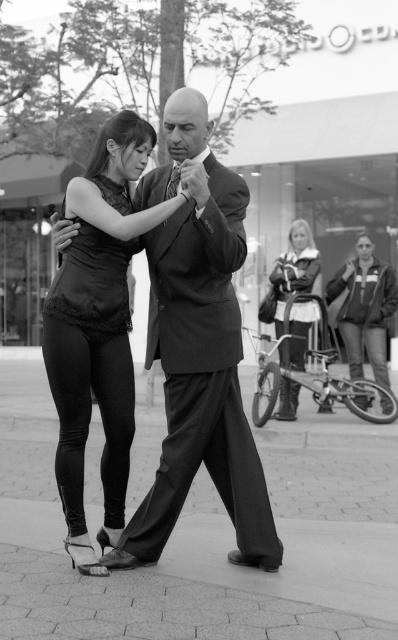
Is point (115, 193) positioned in front of point (282, 305)?

That is True.

Does silky black dress at center have a greater width compared to velvet-like black dress at center?

No.

Describe the element at coordinates (93, 282) in the screenshot. This screenshot has width=398, height=640. I see `silky black dress at center` at that location.

At what (x,y) coordinates should I click in order to perform the action: click on silky black dress at center. Please return your answer as a coordinate pair (x, y). Image resolution: width=398 pixels, height=640 pixels. Looking at the image, I should click on (93, 282).

Is the position of smooth concrete pavement at center more distant than that of velvet-like black dress at center?

No, smooth concrete pavement at center is in front of velvet-like black dress at center.

Who is positioned more to the right, smooth concrete pavement at center or velvet-like black dress at center?

velvet-like black dress at center

Which is behind, point (230, 538) or point (290, 419)?

The point (290, 419) is behind.

Locate an element on the screen. The height and width of the screenshot is (640, 398). smooth concrete pavement at center is located at coordinates (280, 538).

From the picture: Is smooth concrete pavement at center shorter than satin black dress at center?

Correct, smooth concrete pavement at center is not as tall as satin black dress at center.

Who is more forward, (105, 611) or (111, 449)?

Point (105, 611)

Identify the location of smooth concrete pavement at center. The image size is (398, 640). (280, 538).